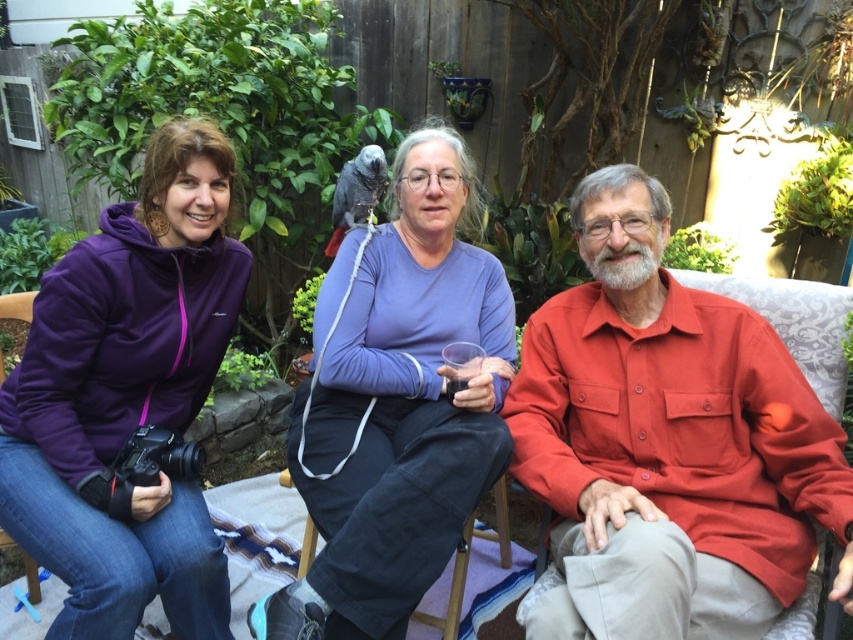
You are standing in the garden and want to walk towards both the point at coordinates point (209, 381) and the point at coordinates point (357, 604). Which point will you reach first?

You will reach the point at coordinates point (209, 381) first because it is closer to you than the point at coordinates point (357, 604).

You are standing in the garden and see the point at coordinates (666,442). Which object is this point located on?

The point at coordinates (666,442) is located on the matte orange shirt at right.